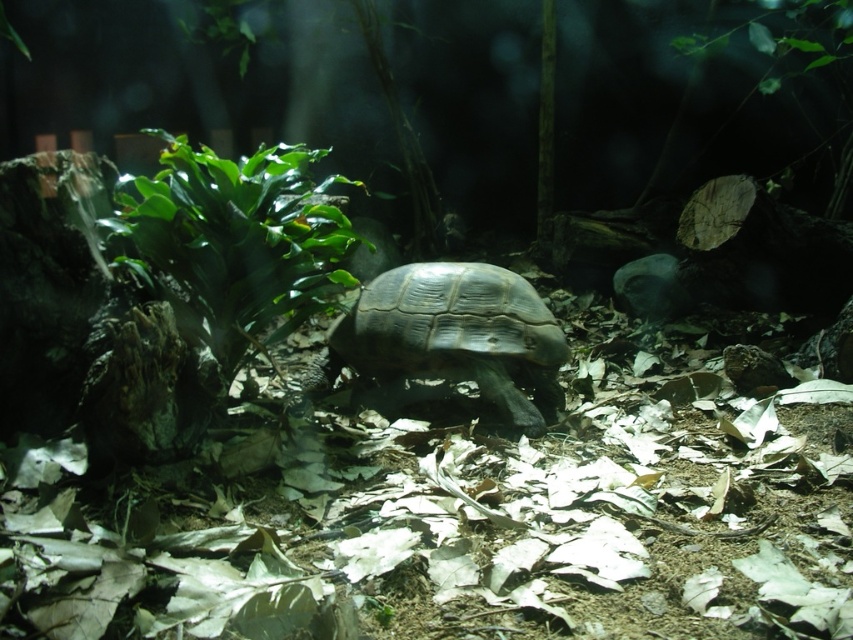
Between green glossy leafy plant at center-left and shiny brown tortoise at center, which one is positioned lower?

shiny brown tortoise at center is below.

Does green glossy leafy plant at center-left appear on the right side of shiny brown tortoise at center?

No, green glossy leafy plant at center-left is not to the right of shiny brown tortoise at center.

Describe the element at coordinates (236, 241) in the screenshot. I see `green glossy leafy plant at center-left` at that location.

Where is `green glossy leafy plant at center-left`? This screenshot has height=640, width=853. green glossy leafy plant at center-left is located at coordinates pos(236,241).